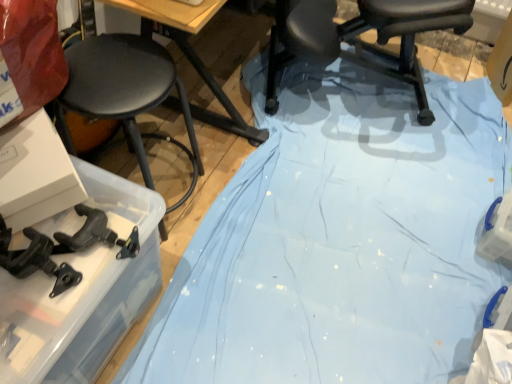
Identify the location of vacant space behind black matte stool at left. (164, 125).